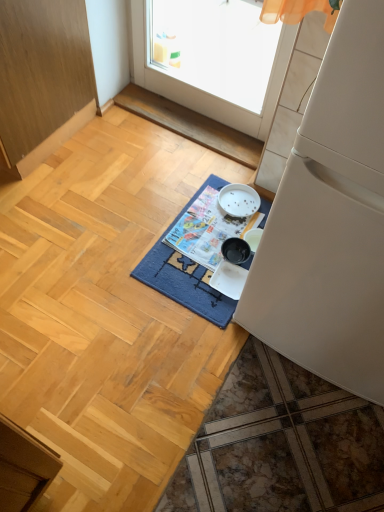
Question: In the image, is wooden cabinet at left on the left side or the right side of blue woven mat at center?

Choices:
 (A) left
 (B) right

Answer: (A)

Question: From a real-world perspective, is wooden cabinet at left physically located above or below blue woven mat at center?

Choices:
 (A) above
 (B) below

Answer: (A)

Question: Which object is the farthest from the white matte refrigerator at right?

Choices:
 (A) printed paper magazine at center
 (B) wooden cabinet at left
 (C) blue woven mat at center

Answer: (B)

Question: Estimate the real-world distances between objects in this image. Which object is farther from the printed paper magazine at center?

Choices:
 (A) white matte refrigerator at right
 (B) blue woven mat at center
 (C) wooden cabinet at left

Answer: (C)